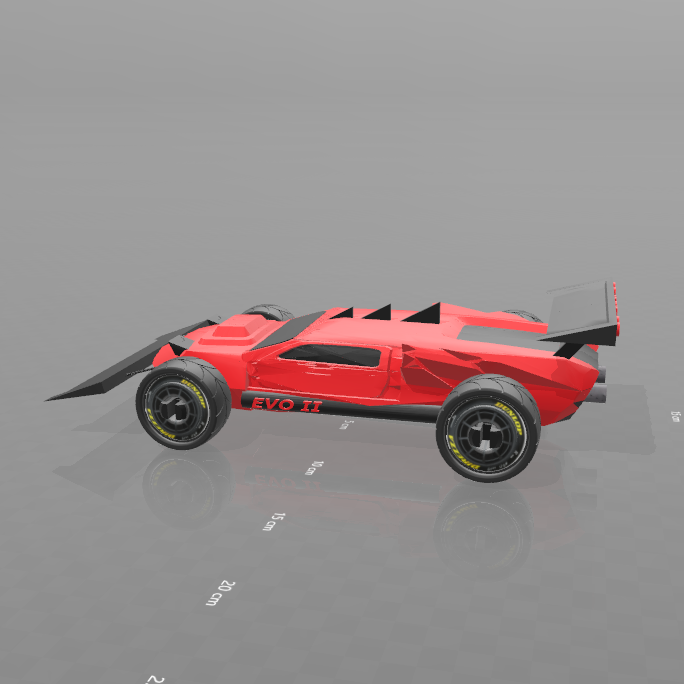
Where is `door`? door is located at coordinates (326, 376).